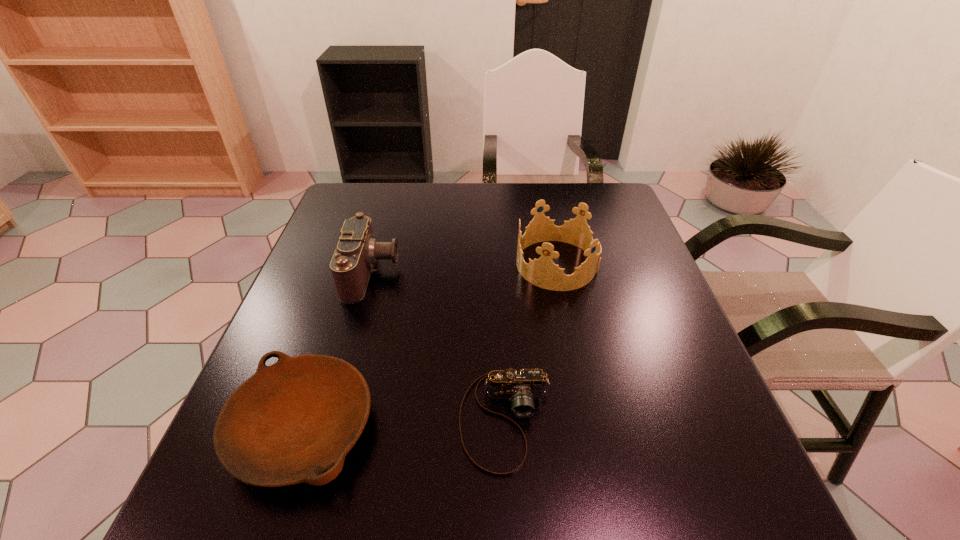
Identify the location of vacant area between the tiara and the plate. tap(430, 346).

This screenshot has width=960, height=540. Identify the location of vacant region between the shorter camera and the tiara. (531, 342).

In order to click on vacant space in between the left camera and the plate in this screenshot , I will do pos(337,350).

I want to click on object that is the closest to the nearer camera, so click(x=290, y=422).

Locate which object ranks second in proximity to the taller camera. Please provide its 2D coordinates. Your answer should be formatted as a tuple, i.e. [(x, y)], where the tuple contains the x and y coordinates of a point satisfying the conditions above.

[(521, 387)]

Locate an element on the screen. free point that satisfies the following two spatial constraints: 1. on the front-facing side of the tiara; 2. on the front-facing side of the nearer camera is located at coordinates (588, 420).

Locate an element on the screen. vacant space that satisfies the following two spatial constraints: 1. on the front-facing side of the taller camera; 2. on the front side of the plate is located at coordinates (328, 428).